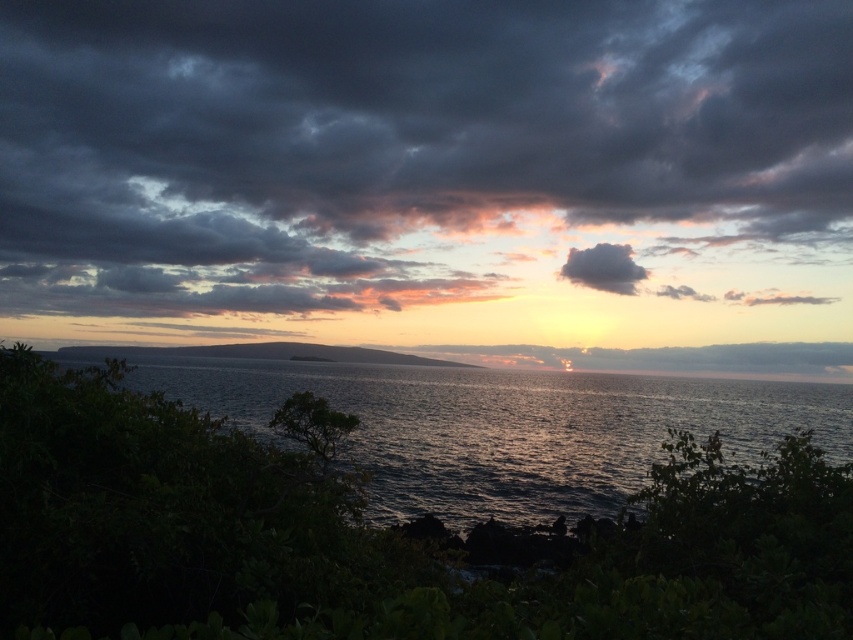
Between dark gray cloud at upper center and dark gray fluffy cloud at upper center, which one appears on the left side from the viewer's perspective?

From the viewer's perspective, dark gray cloud at upper center appears more on the left side.

Is point (357, 240) behind point (608, 269)?

No, (357, 240) is in front of (608, 269).

Image resolution: width=853 pixels, height=640 pixels. I want to click on dark gray cloud at upper center, so 412,150.

Does dark blue water at center lie in front of dark gray fluffy cloud at upper center?

Yes.

In order to click on dark blue water at center in this screenshot , I will do [508, 428].

Does dark gray cloud at upper center have a lesser height compared to dark blue water at center?

Incorrect, dark gray cloud at upper center's height does not fall short of dark blue water at center's.

Can you confirm if dark gray cloud at upper center is bigger than dark blue water at center?

Correct, dark gray cloud at upper center is larger in size than dark blue water at center.

Is point (32, 22) farther from camera compared to point (437, 440)?

Yes, point (32, 22) is behind point (437, 440).

Where is `dark gray cloud at upper center`? This screenshot has width=853, height=640. dark gray cloud at upper center is located at coordinates (412, 150).